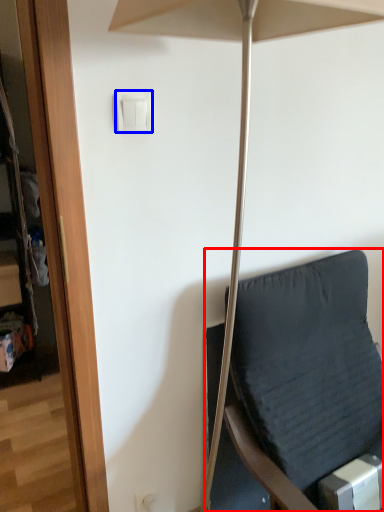
Question: Which object appears closest to the camera in this image, furniture (highlighted by a red box) or light switch (highlighted by a blue box)?

Choices:
 (A) furniture
 (B) light switch

Answer: (A)